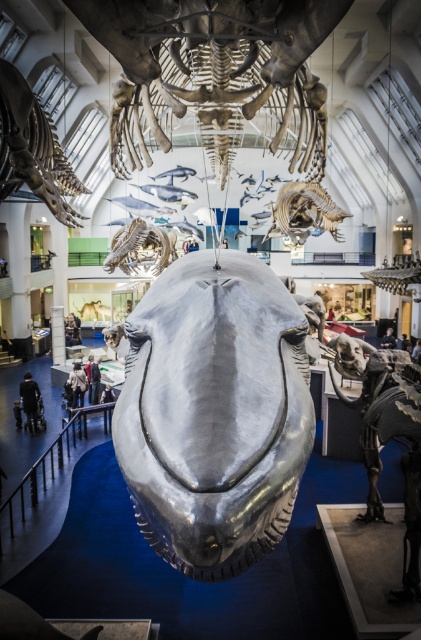
Who is more distant from viewer, (396, 340) or (402, 342)?

Point (396, 340)

Consider the image. Between dark blue fabric at lower center and dark gray fabric jacket at lower center, which one has less height?

Standing shorter between the two is dark blue fabric at lower center.

Is point (383, 344) farther from viewer compared to point (410, 348)?

Yes.

Identify the location of dark blue fabric at lower center. (389, 339).

Can you confirm if shiny silver dinosaur at upper left is taller than black fabric at lower left?

Indeed, shiny silver dinosaur at upper left has a greater height compared to black fabric at lower left.

Does point (31, 182) come farther from viewer compared to point (23, 404)?

No, (31, 182) is closer to viewer.

Describe the element at coordinates (32, 148) in the screenshot. I see `shiny silver dinosaur at upper left` at that location.

Locate an element on the screen. The width and height of the screenshot is (421, 640). shiny silver dinosaur at upper left is located at coordinates (32, 148).

Which of these two, shiny metallic dinosaur at upper right or matte black jacket at lower center, stands shorter?

Standing shorter between the two is matte black jacket at lower center.

Does shiny metallic dinosaur at upper right have a larger size compared to matte black jacket at lower center?

Yes, shiny metallic dinosaur at upper right is bigger than matte black jacket at lower center.

Is point (410, 280) more distant than point (76, 364)?

No, it is in front of (76, 364).

Identify the location of shiny metallic dinosaur at upper right. (397, 273).